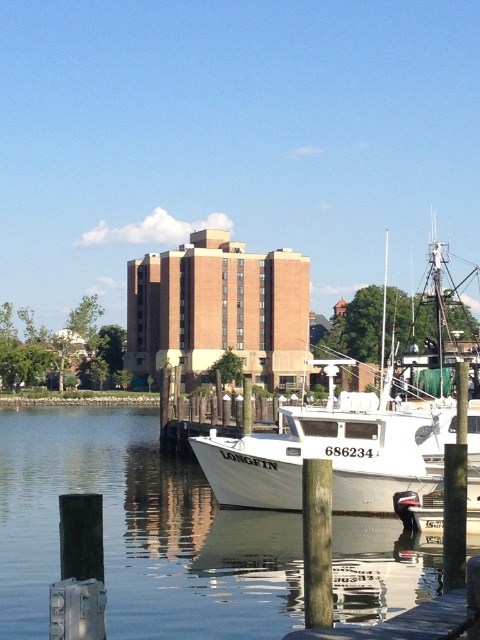
Question: Can you confirm if white matte boat at center is positioned to the left of wooden at lower right?

Choices:
 (A) yes
 (B) no

Answer: (B)

Question: Which is nearer to the white matte boat at center?

Choices:
 (A) clear water at lower center
 (B) wooden at lower right

Answer: (A)

Question: Among these points, which one is farthest from the camera?

Choices:
 (A) (121, 628)
 (B) (385, 636)

Answer: (A)

Question: Can you confirm if clear water at lower center is positioned below wooden at lower right?

Choices:
 (A) no
 (B) yes

Answer: (B)

Question: Among these objects, which one is nearest to the camera?

Choices:
 (A) wooden at lower right
 (B) clear water at lower center
 (C) white matte boat at center

Answer: (A)

Question: Can you confirm if clear water at lower center is smaller than white matte boat at center?

Choices:
 (A) no
 (B) yes

Answer: (A)